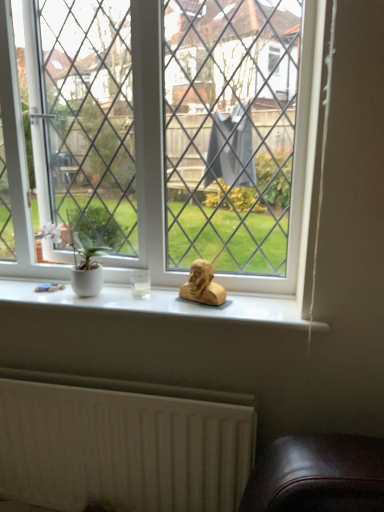
You are a GUI agent. You are given a task and a screenshot of the screen. Output one action in this format:
    pyautogui.click(x=<x>, y=<y>)
    Task: Click on the clear glass window at center
    This screenshot has height=512, width=384.
    Given the screenshot: What is the action you would take?
    pyautogui.click(x=91, y=140)

Which is in front, clear glass window at center or matte gold bust at center?

clear glass window at center.

You are a GUI agent. You are given a task and a screenshot of the screen. Output one action in this format:
    pyautogui.click(x=<x>, y=<y>)
    Task: Click on the window that appears on the left of matte gold bust at center
    The height and width of the screenshot is (512, 384).
    Given the screenshot: What is the action you would take?
    pyautogui.click(x=91, y=140)

Measure the distance between clear glass window at center and matte gold bust at center.

clear glass window at center and matte gold bust at center are 18.89 inches apart from each other.

Is clear glass window at center smaller than matte gold bust at center?

No, clear glass window at center is not smaller than matte gold bust at center.

From their relative heights in the image, would you say matte gold bust at center is taller or shorter than white textured radiator at lower left?

matte gold bust at center is shorter than white textured radiator at lower left.

Looking at the image, does matte gold bust at center seem bigger or smaller compared to white textured radiator at lower left?

In the image, matte gold bust at center appears to be smaller than white textured radiator at lower left.

How many degrees apart are the facing directions of matte gold bust at center and white textured radiator at lower left?

22.7 degrees separate the facing orientations of matte gold bust at center and white textured radiator at lower left.

From the picture: Is matte gold bust at center facing towards clear glass window at center?

No, matte gold bust at center is not oriented towards clear glass window at center.

In the image, is matte gold bust at center positioned in front of or behind clear glass window at center?

matte gold bust at center is behind clear glass window at center.

Is matte gold bust at center positioned beyond the bounds of clear glass window at center?

Absolutely, matte gold bust at center is external to clear glass window at center.

From a real-world perspective, between matte gold bust at center and clear glass window at center, who is vertically higher?

clear glass window at center is physically above.

Does clear glass window at center lie behind white textured radiator at lower left?

No, clear glass window at center is closer to the camera.

Considering the sizes of objects clear glass window at center and white textured radiator at lower left in the image provided, who is thinner, clear glass window at center or white textured radiator at lower left?

white textured radiator at lower left is thinner.

Is point (66, 137) positioned in front of point (235, 397)?

No, (66, 137) is behind (235, 397).

Is point (215, 445) positioned in front of point (192, 270)?

Yes, point (215, 445) is in front of point (192, 270).

How many degrees apart are the facing directions of white textured radiator at lower left and matte gold bust at center?

They differ by 22.7 degrees in their facing directions.

Considering the positions of objects white textured radiator at lower left and matte gold bust at center in the image provided, who is behind, white textured radiator at lower left or matte gold bust at center?

Positioned behind is matte gold bust at center.

The width and height of the screenshot is (384, 512). Find the location of `animal that appears behind the white textured radiator at lower left`. animal that appears behind the white textured radiator at lower left is located at coordinates (202, 285).

Can you confirm if white textured radiator at lower left is thinner than clear glass window at center?

Yes, white textured radiator at lower left is thinner than clear glass window at center.

Is clear glass window at center completely or partially inside white textured radiator at lower left?

No.

Can you confirm if white textured radiator at lower left is shorter than clear glass window at center?

Indeed, white textured radiator at lower left has a lesser height compared to clear glass window at center.

Identify the location of window that appears on the left of matte gold bust at center. The image size is (384, 512). (91, 140).

Identify the location of animal that appears above the white textured radiator at lower left (from a real-world perspective). Image resolution: width=384 pixels, height=512 pixels. (202, 285).

When comparing their distances from white textured radiator at lower left, does matte gold bust at center or clear glass window at center seem closer?

matte gold bust at center.

When comparing their distances from clear glass window at center, does white textured radiator at lower left or matte gold bust at center seem further?

white textured radiator at lower left lies further to clear glass window at center than the other object.

Looking at the image, which one is located closer to matte gold bust at center, clear glass window at center or white textured radiator at lower left?

The object closer to matte gold bust at center is clear glass window at center.

Looking at the image, which one is located further to white textured radiator at lower left, clear glass window at center or matte gold bust at center?

The object further to white textured radiator at lower left is clear glass window at center.

Estimate the real-world distances between objects in this image. Which object is closer to matte gold bust at center, white textured radiator at lower left or clear glass window at center?

clear glass window at center lies closer to matte gold bust at center than the other object.

Looking at the image, which one is located closer to clear glass window at center, matte gold bust at center or white textured radiator at lower left?

The object closer to clear glass window at center is matte gold bust at center.

The width and height of the screenshot is (384, 512). What are the coordinates of `animal that lies between clear glass window at center and white textured radiator at lower left from top to bottom` in the screenshot? It's located at (202, 285).